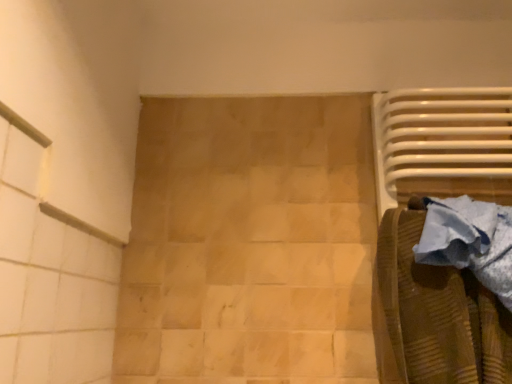
What do you see at coordinates (434, 314) in the screenshot?
I see `brown striped fabric at lower right` at bounding box center [434, 314].

Identify the location of brown striped fabric at lower right. (434, 314).

The height and width of the screenshot is (384, 512). I want to click on brown striped fabric at lower right, so pos(434,314).